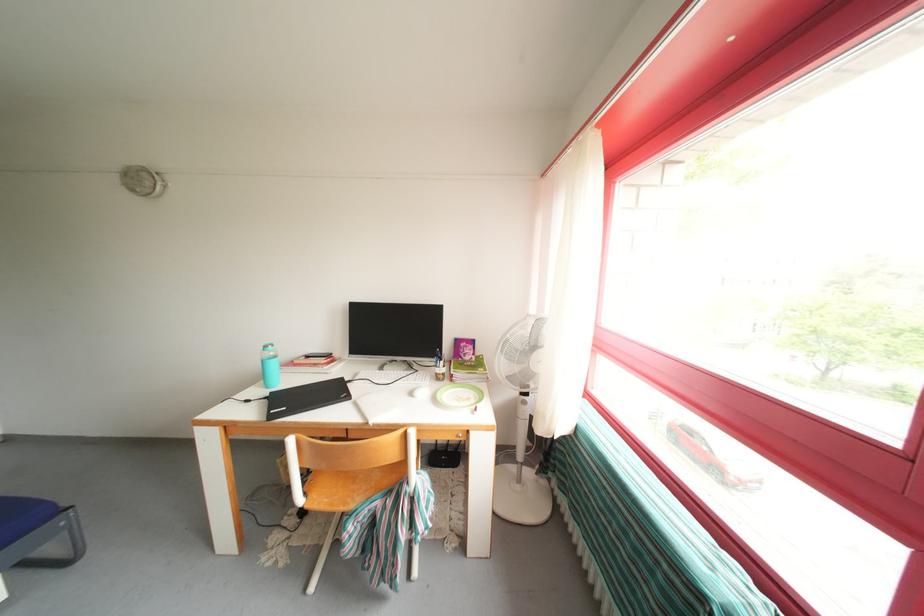
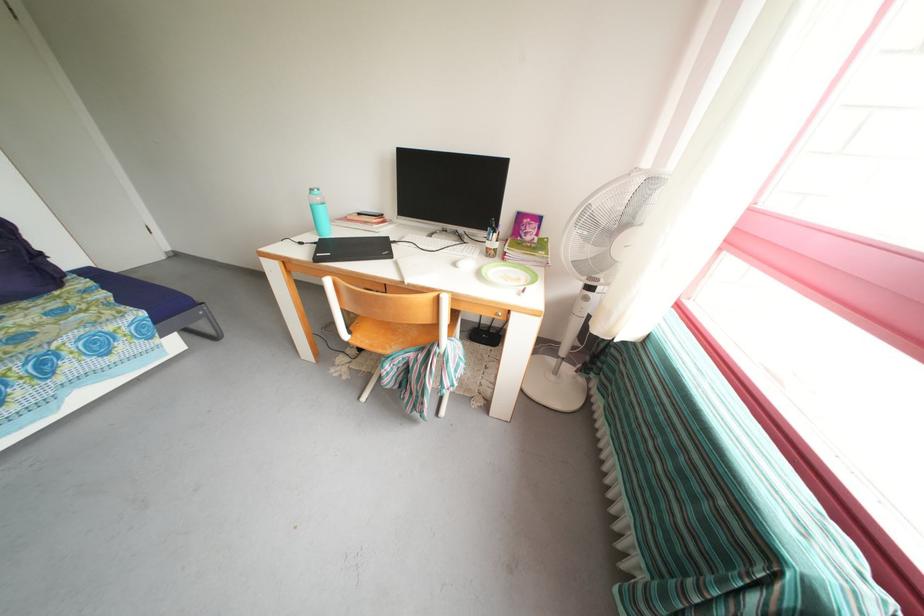
Locate, in the second image, the point that corresponds to (388,374) in the first image.

(436, 241)